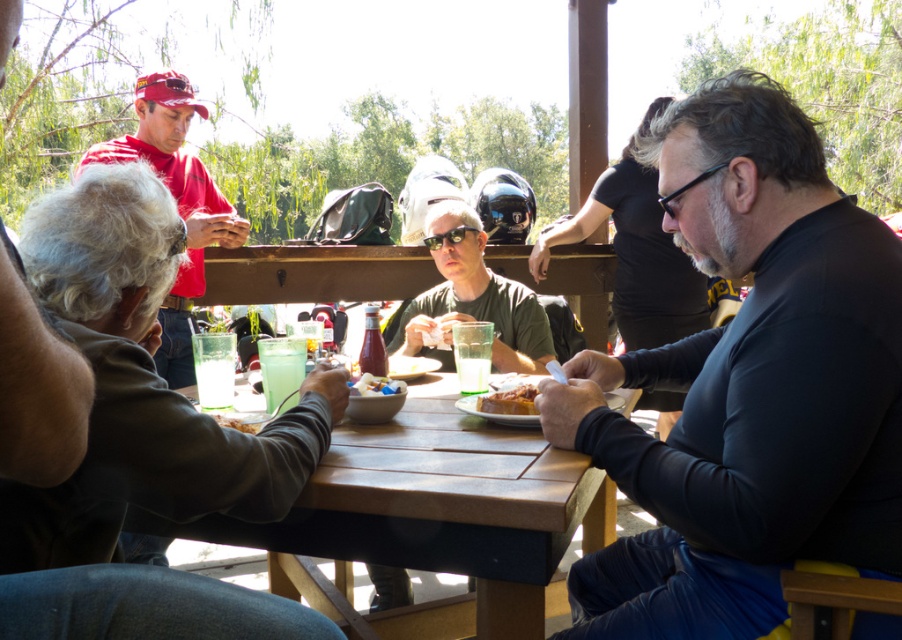
What is located at the coordinates point (376,385)?

The smooth plastic bowl at center is located at point (376,385).

You are planning to place a decorative vase on the wooden table at center. The vase is 10 cm tall. Considering the height of the red matte cap at upper left, is the table tall enough to prevent the vase from toppling over?

The wooden table at center is shorter than the red matte cap at upper left. Since the vase is only 10 cm tall, the table should be tall enough to support it without toppling over, as the cap being taller doesn